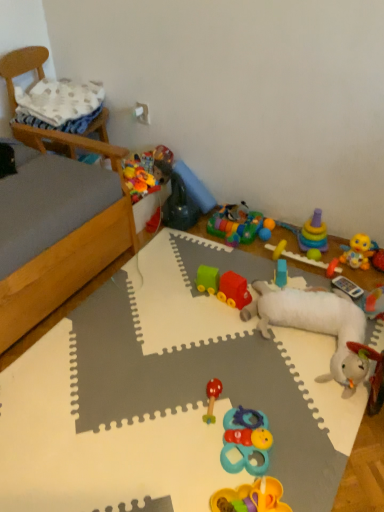
Identify the location of free spot to the left of rubberized red mushroom at center, which is counted as the ninth toy, starting from the top. The height and width of the screenshot is (512, 384). (163, 406).